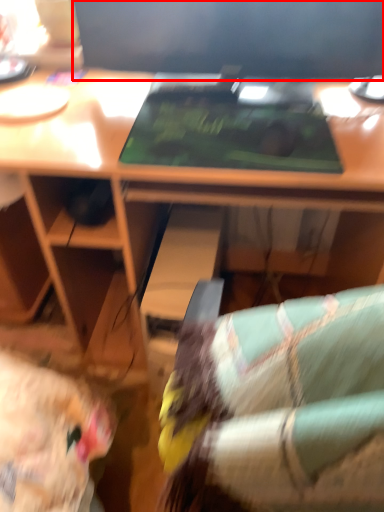
Question: In this image, where is computer monitor (annotated by the red box) located relative to laptop?

Choices:
 (A) right
 (B) left

Answer: (A)